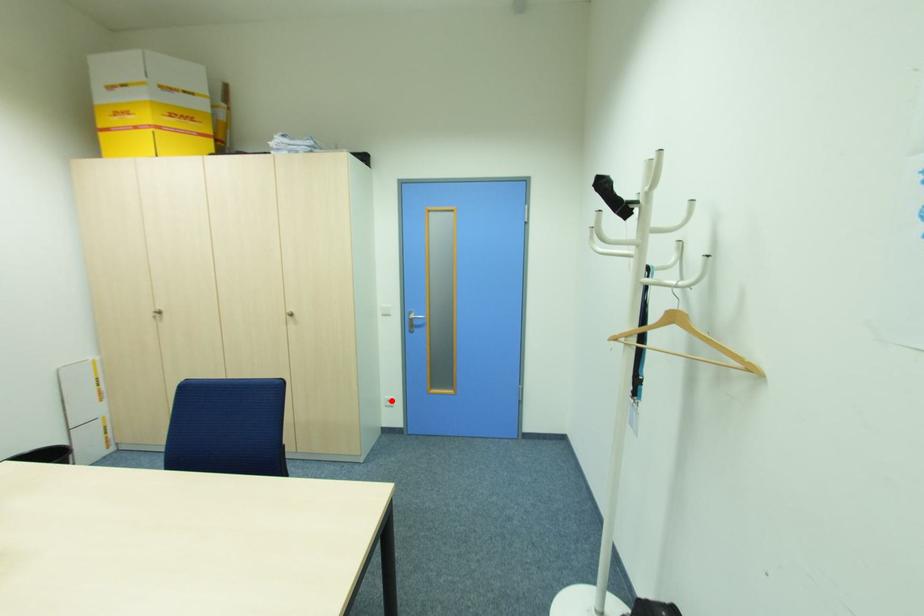
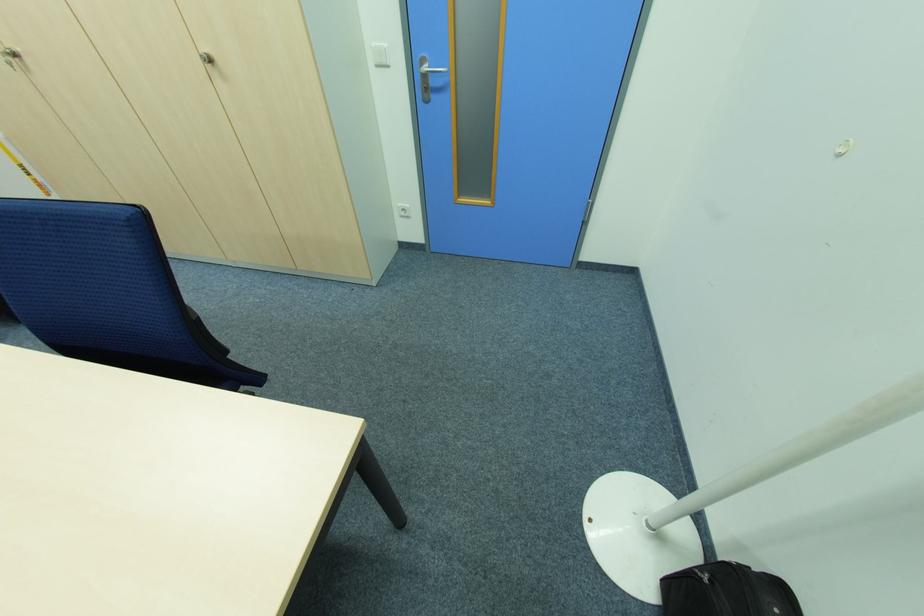
Question: I am providing you with two images of the same scene from different viewpoints. A red point is shown in image1. For the corresponding object point in image2, is it positioned nearer or farther from the camera?

Choices:
 (A) Nearer
 (B) Farther

Answer: (A)